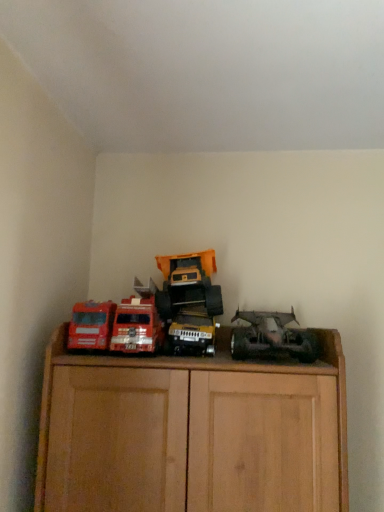
Question: Could you tell me if rusty metal truck at right, acting as the fourth toy starting from the left, is facing matte red truck at left, the fourth toy viewed from the right?

Choices:
 (A) yes
 (B) no

Answer: (B)

Question: Can we say rusty metal truck at right, acting as the fourth toy starting from the left, lies outside matte red truck at left, the fourth toy viewed from the right?

Choices:
 (A) no
 (B) yes

Answer: (B)

Question: From the image's perspective, is rusty metal truck at right, which appears as the 1th toy when viewed from the right, above matte red truck at left, which is the 1th toy from left to right?

Choices:
 (A) no
 (B) yes

Answer: (A)

Question: From a real-world perspective, is rusty metal truck at right, acting as the fourth toy starting from the left, located beneath matte red truck at left, which is the 1th toy from left to right?

Choices:
 (A) yes
 (B) no

Answer: (B)

Question: Is rusty metal truck at right, acting as the fourth toy starting from the left, turned away from matte red truck at left, the fourth toy viewed from the right?

Choices:
 (A) no
 (B) yes

Answer: (A)

Question: Considering the relative positions of rusty metal truck at right, acting as the fourth toy starting from the left, and matte red truck at left, the fourth toy viewed from the right, in the image provided, is rusty metal truck at right, acting as the fourth toy starting from the left, to the right of matte red truck at left, the fourth toy viewed from the right, from the viewer's perspective?

Choices:
 (A) yes
 (B) no

Answer: (A)

Question: Is metallic yellow truck at center, the 3th toy in the left-to-right sequence, facing towards metallic red fire truck at left, the 2th toy viewed from the left?

Choices:
 (A) yes
 (B) no

Answer: (B)

Question: Is metallic yellow truck at center, the 3th toy in the left-to-right sequence, with metallic red fire truck at left, the third toy when ordered from right to left?

Choices:
 (A) yes
 (B) no

Answer: (B)

Question: From a real-world perspective, is metallic yellow truck at center, acting as the 2th toy starting from the right, on top of metallic red fire truck at left, the 2th toy viewed from the left?

Choices:
 (A) no
 (B) yes

Answer: (A)

Question: Is metallic yellow truck at center, the 3th toy in the left-to-right sequence, positioned in front of metallic red fire truck at left, the 2th toy viewed from the left?

Choices:
 (A) no
 (B) yes

Answer: (B)

Question: Is metallic yellow truck at center, the 3th toy in the left-to-right sequence, looking in the opposite direction of metallic red fire truck at left, the 2th toy viewed from the left?

Choices:
 (A) yes
 (B) no

Answer: (B)

Question: Can we say metallic yellow truck at center, acting as the 2th toy starting from the right, lies outside metallic red fire truck at left, the 2th toy viewed from the left?

Choices:
 (A) yes
 (B) no

Answer: (A)

Question: From the image's perspective, would you say metallic red fire truck at left, the 2th toy viewed from the left, is shown under rusty metal truck at right, which appears as the 1th toy when viewed from the right?

Choices:
 (A) yes
 (B) no

Answer: (B)